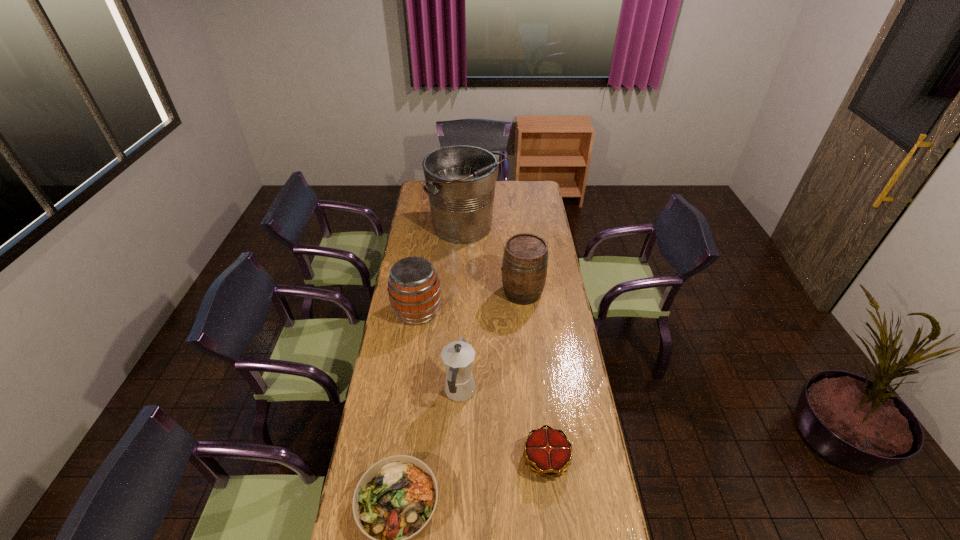
Choose which object is the nearest neighbor to the tallest object. Please provide its 2D coordinates. Your answer should be formatted as a tuple, i.e. [(x, y)], where the tuple contains the x and y coordinates of a point satisfying the conditions above.

[(524, 268)]

Where is `free space that satisfies the following two spatial constraints: 1. on the side of the right cider near the bung hole; 2. on the right side of the crown`? This screenshot has height=540, width=960. free space that satisfies the following two spatial constraints: 1. on the side of the right cider near the bung hole; 2. on the right side of the crown is located at coordinates (540, 459).

Where is `vacant space that satisfies the following two spatial constraints: 1. on the front side of the crown; 2. on the right side of the left cider`? vacant space that satisfies the following two spatial constraints: 1. on the front side of the crown; 2. on the right side of the left cider is located at coordinates (396, 459).

Image resolution: width=960 pixels, height=540 pixels. I want to click on free space that satisfies the following two spatial constraints: 1. on the front side of the left cider; 2. on the left side of the fourth farthest object, so pyautogui.click(x=405, y=392).